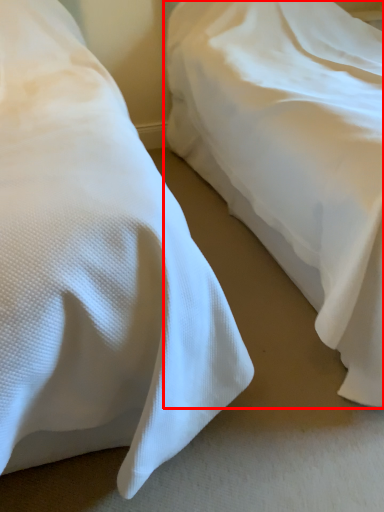
Question: From the image's perspective, where is bed (annotated by the red box) located relative to bed?

Choices:
 (A) above
 (B) below

Answer: (A)